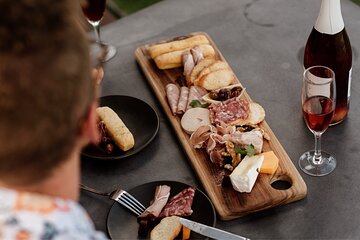
Locate an element on the screen. base of wine glass is located at coordinates (320, 167).